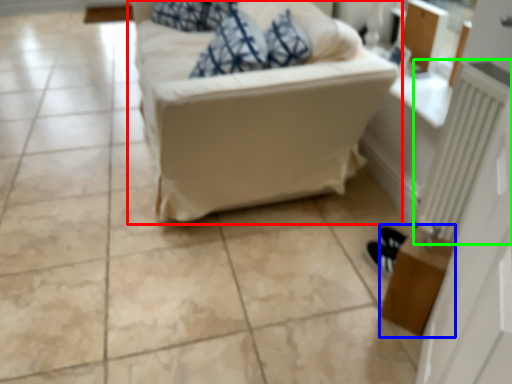
Question: Which object is the closest to the studio couch (highlighted by a red box)? Choose among these: table (highlighted by a blue box) or radiator (highlighted by a green box).

Choices:
 (A) table
 (B) radiator

Answer: (B)